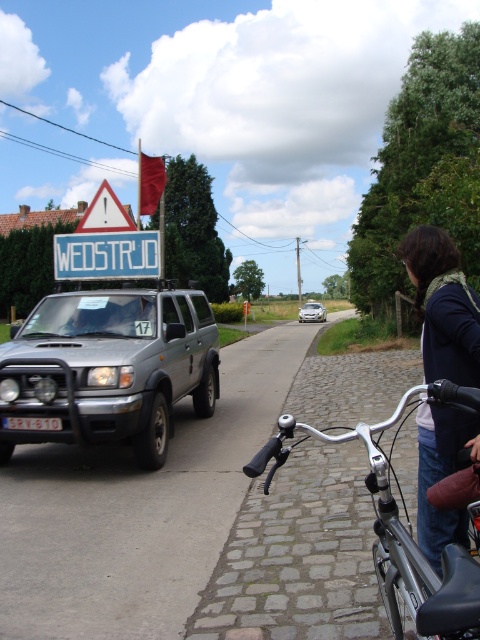
Is white triangular warning sign at upper left below silver metallic car at center?

No, white triangular warning sign at upper left is not below silver metallic car at center.

Between point (109, 188) and point (303, 316), which one is positioned in front?

Point (109, 188) is more forward.

Is point (112, 209) positioned behind point (312, 310)?

No, it is not.

What are the coordinates of `white triangular warning sign at upper left` in the screenshot? It's located at (105, 212).

Is point (84, 417) positioned behind point (435, 314)?

That is True.

Does silver metallic suv at left have a larger size compared to dark blue sweater at right?

Indeed, silver metallic suv at left has a larger size compared to dark blue sweater at right.

Who is more distant from viewer, (x=24, y=392) or (x=454, y=509)?

The point (x=24, y=392) is behind.

Find the location of a particular element. The width and height of the screenshot is (480, 640). silver metallic suv at left is located at coordinates (109, 368).

Where is `silver metallic suv at left`? The width and height of the screenshot is (480, 640). silver metallic suv at left is located at coordinates (109, 368).

Find the location of a particular element. This screenshot has width=480, height=640. silver metallic suv at left is located at coordinates pyautogui.click(x=109, y=368).